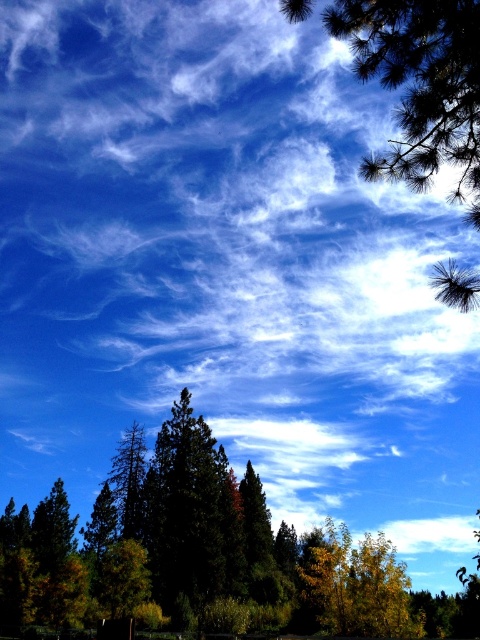
The width and height of the screenshot is (480, 640). What do you see at coordinates (192, 513) in the screenshot?
I see `dark green pine at center` at bounding box center [192, 513].

Who is positioned more to the right, dark green pine at center or green matte tree at center?

Positioned to the right is dark green pine at center.

Which is behind, point (172, 426) or point (121, 444)?

The point (172, 426) is behind.

You are a GUI agent. You are given a task and a screenshot of the screen. Output one action in this format:
    pyautogui.click(x=<x>, y=<y>)
    Task: Click on the dark green pine at center
    The height and width of the screenshot is (640, 480).
    Given the screenshot: What is the action you would take?
    pyautogui.click(x=192, y=513)

Between dark green trees at center and dark green pine at center, which one is positioned lower?

dark green trees at center is below.

Does dark green trees at center appear over dark green pine at center?

No, dark green trees at center is not above dark green pine at center.

Looking at this image, who is more forward, [216,492] or [231,561]?

Point [216,492] is in front.

At what (x,y) coordinates should I click in order to perform the action: click on dark green trees at center. Please return your answer as a coordinate pair (x, y). The width and height of the screenshot is (480, 640). Looking at the image, I should click on (210, 560).

Does dark green trees at center lie in front of green matte tree at center?

Yes, it is in front of green matte tree at center.

Between point (168, 484) and point (136, 538), which one is positioned in front?

Point (136, 538)

The height and width of the screenshot is (640, 480). I want to click on dark green trees at center, so click(210, 560).